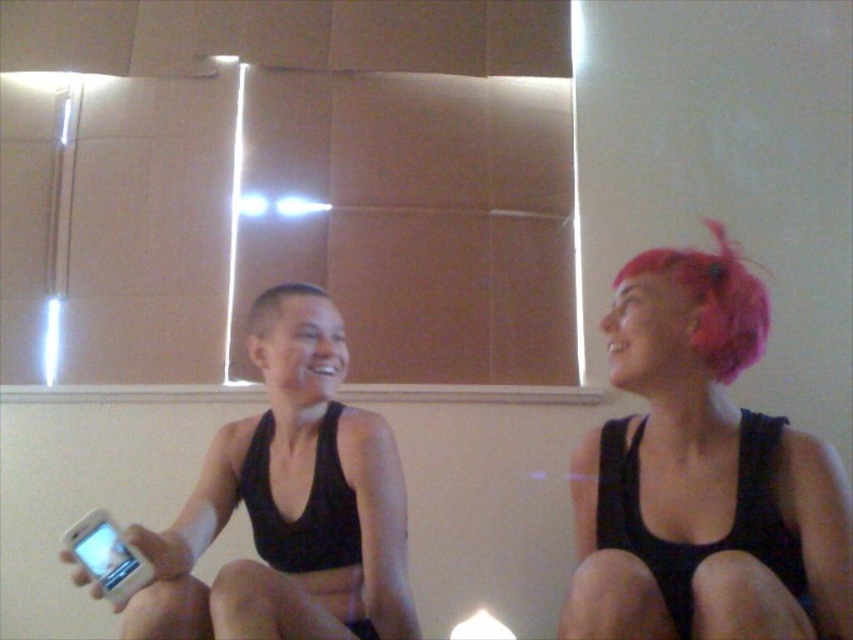
Does pink matte hair at upper right appear on the left side of black matte tank top at center?

Incorrect, pink matte hair at upper right is not on the left side of black matte tank top at center.

Is pink matte hair at upper right smaller than black matte tank top at center?

Indeed, pink matte hair at upper right has a smaller size compared to black matte tank top at center.

Who is more distant from viewer, (x=805, y=564) or (x=305, y=465)?

Positioned behind is point (x=305, y=465).

I want to click on pink matte hair at upper right, so click(x=701, y=476).

Is pink fluffy hair at upper right thinner than short hair at center?

No.

In order to click on pink fluffy hair at upper right in this screenshot , I will do pos(712,301).

Identify the location of pink fluffy hair at upper right. (712, 301).

Is black matte tank top at center positioned before short hair at center?

Yes.

Based on the photo, who is more distant from viewer, (347, 493) or (270, 298)?

The point (270, 298) is behind.

Identify the location of black matte tank top at center. (289, 509).